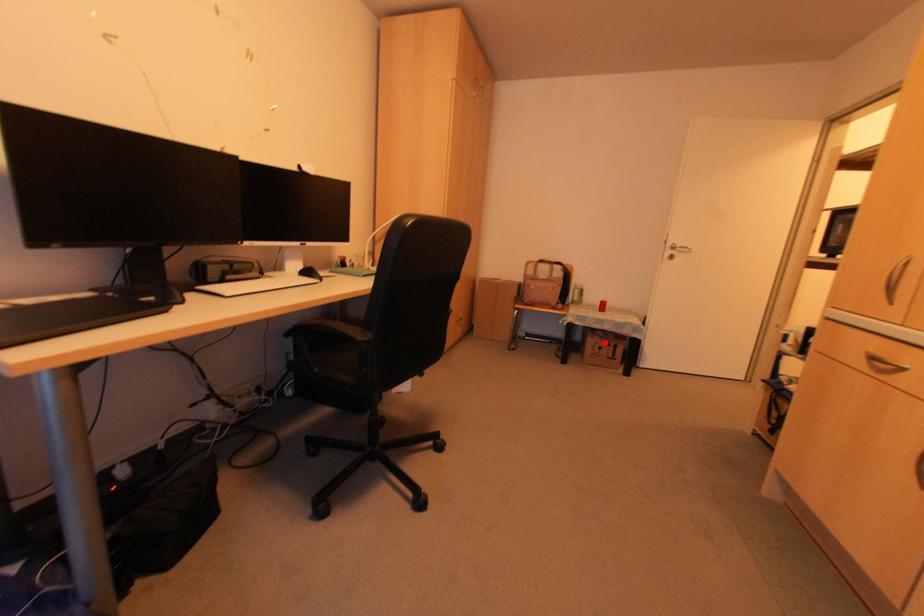
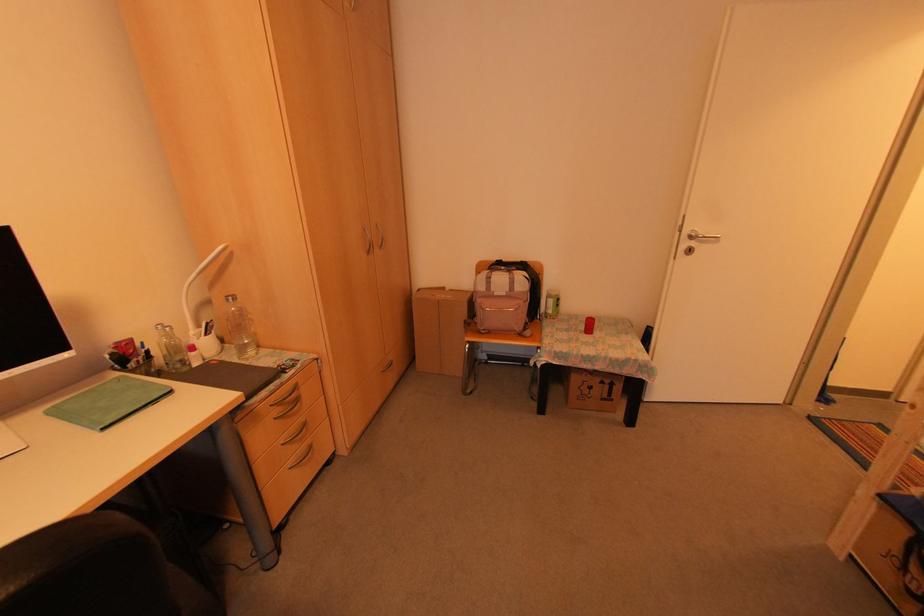
Question: I am providing you with two images of the same scene from different viewpoints. A red point is shown in image1. For the corresponding object point in image2, is it positioned nearer or farther from the camera?

Choices:
 (A) Nearer
 (B) Farther

Answer: (B)